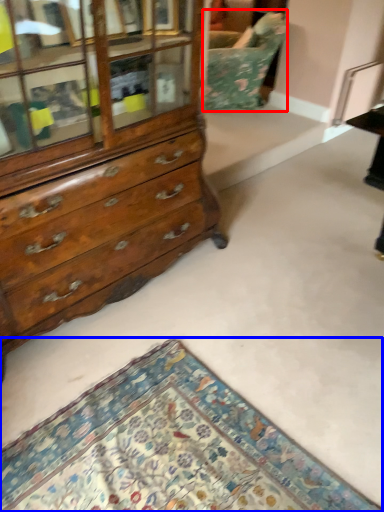
Question: Which object is closer to the camera taking this photo, swivel chair (highlighted by a red box) or mat (highlighted by a blue box)?

Choices:
 (A) swivel chair
 (B) mat

Answer: (B)